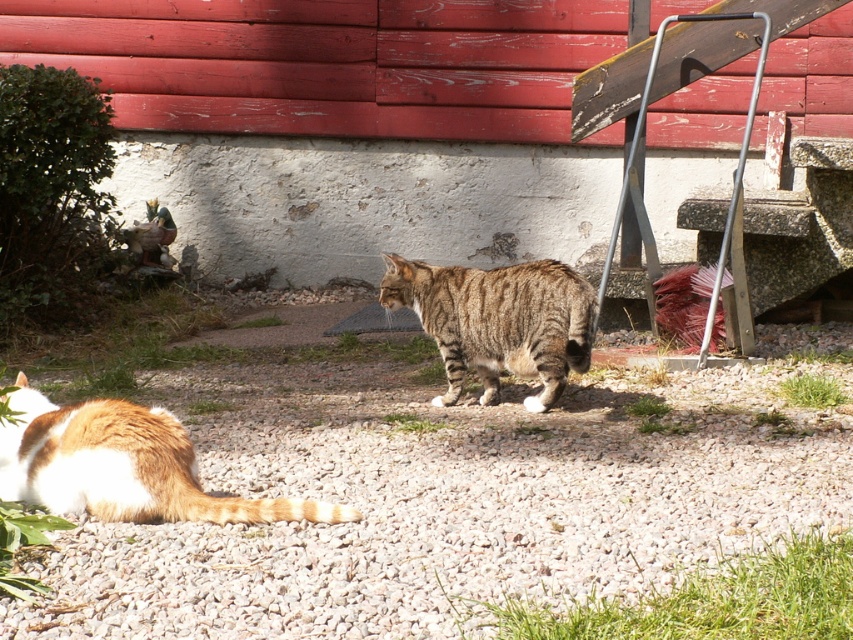
You are standing in a backyard with two points marked on the ground. The first point is at coordinates point (148, 554) and the second point is at point (32, 394). Which point is closer to you?

Point (148, 554) is closer to the viewer than point (32, 394).